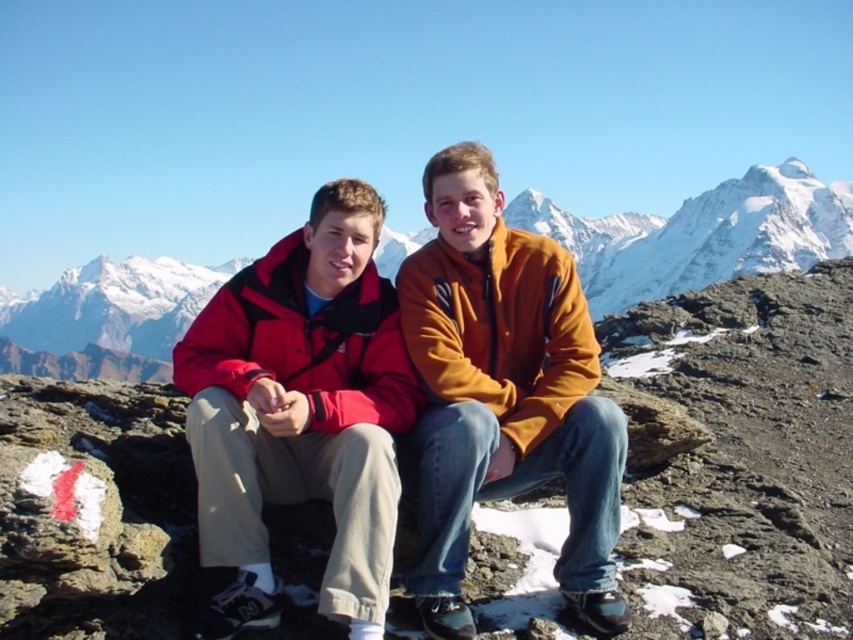
Question: From the image, what is the correct spatial relationship of orange fleece jacket at center in relation to matte red jacket at center?

Choices:
 (A) above
 (B) below

Answer: (B)

Question: Which object is positioned farthest from the matte fleece jackets at center?

Choices:
 (A) orange fleece jacket at center
 (B) snowy mountain at center
 (C) matte red jacket at center

Answer: (B)

Question: Among these objects, which one is nearest to the camera?

Choices:
 (A) matte fleece jackets at center
 (B) matte red jacket at center

Answer: (A)

Question: Can you confirm if orange fleece jacket at center is wider than matte red jacket at center?

Choices:
 (A) yes
 (B) no

Answer: (B)

Question: Can you confirm if snowy mountain at center is bigger than matte red jacket at center?

Choices:
 (A) yes
 (B) no

Answer: (A)

Question: Which of the following is the farthest from the observer?

Choices:
 (A) orange fleece jacket at center
 (B) snowy mountain at center

Answer: (B)